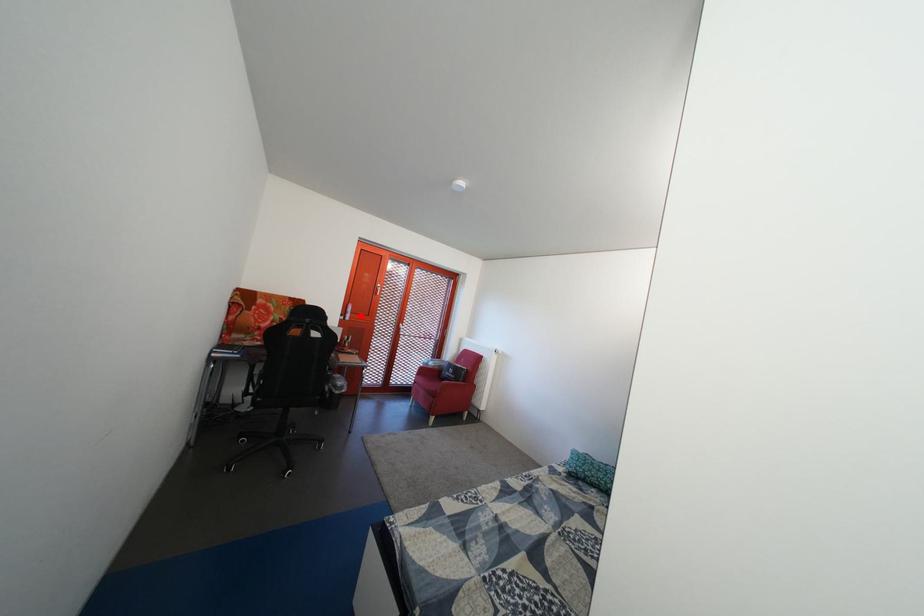
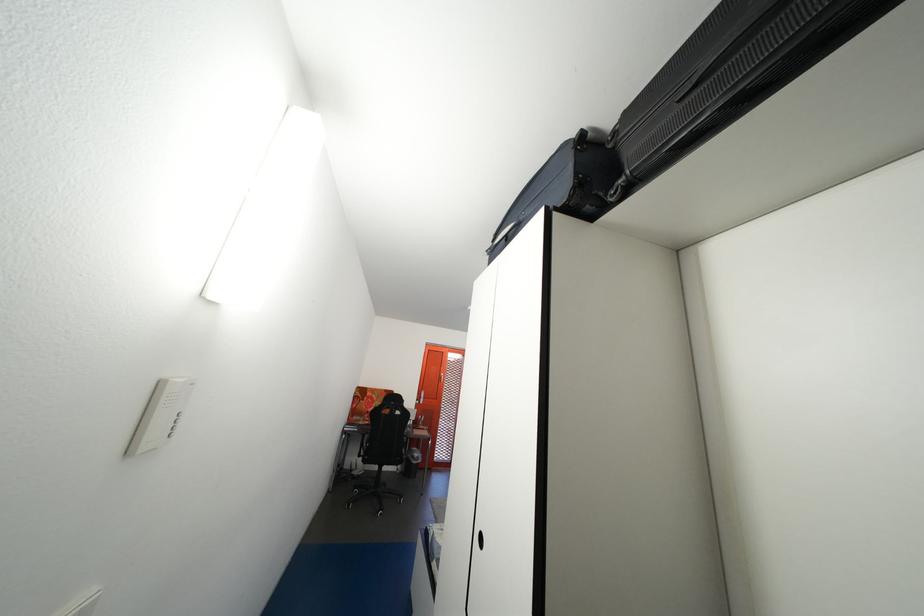
Question: I am providing you with two images of the same scene from different viewpoints. A red point is shown in image1. For the corresponding object point in image2, is it positioned nearer or farther from the camera?

Choices:
 (A) Nearer
 (B) Farther

Answer: (B)